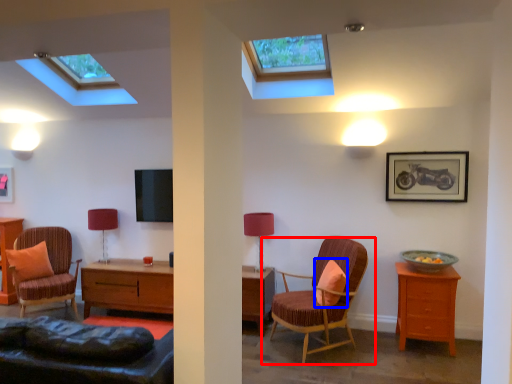
Question: Which of the following is the closest to the observer, chair (highlighted by a red box) or pillow (highlighted by a blue box)?

Choices:
 (A) chair
 (B) pillow

Answer: (A)